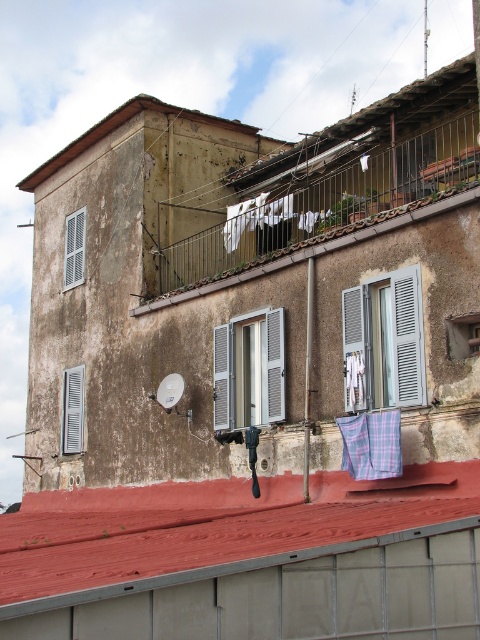
Question: Does white matte window at center appear over plaid fabric at upper center?

Choices:
 (A) no
 (B) yes

Answer: (A)

Question: Considering the relative positions of rusty metal railing at upper center and plaid fabric at center in the image provided, where is rusty metal railing at upper center located with respect to plaid fabric at center?

Choices:
 (A) below
 (B) above

Answer: (B)

Question: Which point is farther to the camera?

Choices:
 (A) (400, 472)
 (B) (288, 180)
 (C) (448, 170)
 (D) (23, 634)

Answer: (B)

Question: Which object is the farthest from the plaid fabric laundry at center?

Choices:
 (A) red corrugated metal at upper center
 (B) weathered concrete roof at upper center

Answer: (B)

Question: Is red corrugated metal at upper center positioned behind plaid fabric at center?

Choices:
 (A) yes
 (B) no

Answer: (B)

Question: Which of these objects is positioned farthest from the white matte shutter at left?

Choices:
 (A) light gray wooden window at center
 (B) rusty metal railing at upper center

Answer: (A)